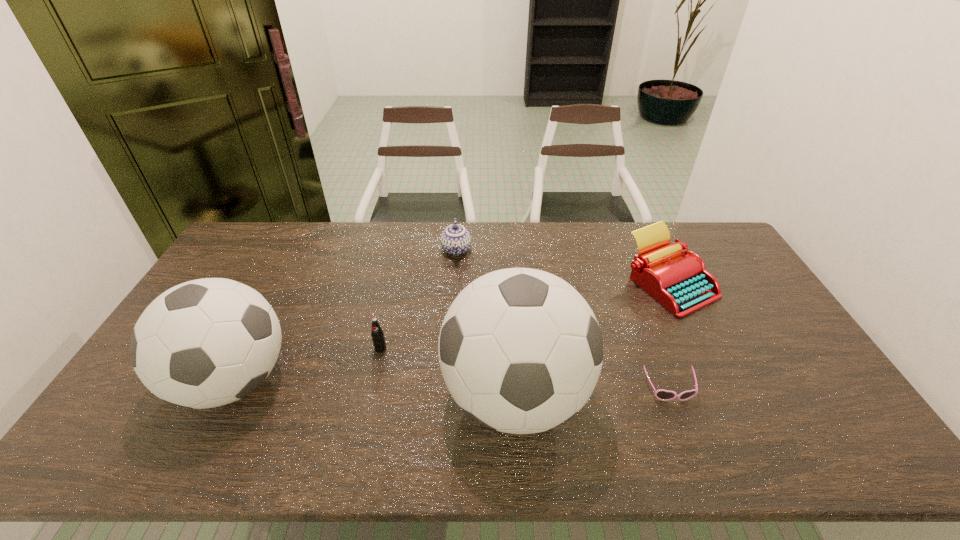
The height and width of the screenshot is (540, 960). I want to click on vacant point located on the typing side of the typewriter, so click(699, 345).

Find the location of a particular element. The width and height of the screenshot is (960, 540). free space located from the spout of the chinaware is located at coordinates (454, 279).

Locate an element on the screen. The height and width of the screenshot is (540, 960). vacant space situated on the front label of the pop is located at coordinates 372,386.

At what (x,y) coordinates should I click in order to perform the action: click on typewriter present at the far edge. Please return your answer as a coordinate pair (x, y). The image size is (960, 540). Looking at the image, I should click on (680, 282).

Find the location of a particular element. The image size is (960, 540). chinaware that is at the far edge is located at coordinates (455, 240).

Where is `sunglasses that is at the near edge`? This screenshot has width=960, height=540. sunglasses that is at the near edge is located at coordinates (663, 395).

Where is `object at the left edge`? The width and height of the screenshot is (960, 540). object at the left edge is located at coordinates (205, 343).

You are a GUI agent. You are given a task and a screenshot of the screen. Output one action in this format:
    pyautogui.click(x=<x>, y=<y>)
    Task: Click on the object located in the right edge section of the desktop
    
    Given the screenshot: What is the action you would take?
    pyautogui.click(x=680, y=282)

The width and height of the screenshot is (960, 540). Find the location of `object that is at the near left corner`. object that is at the near left corner is located at coordinates (205, 343).

Image resolution: width=960 pixels, height=540 pixels. What are the coordinates of `object that is positioned at the far right corner` in the screenshot? It's located at (680, 282).